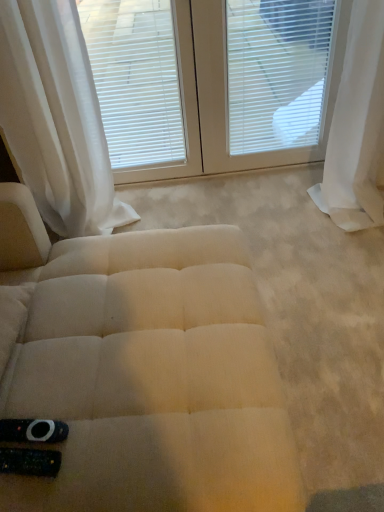
The height and width of the screenshot is (512, 384). I want to click on vacant position to the left of white plastic blinds at upper center, so click(x=211, y=197).